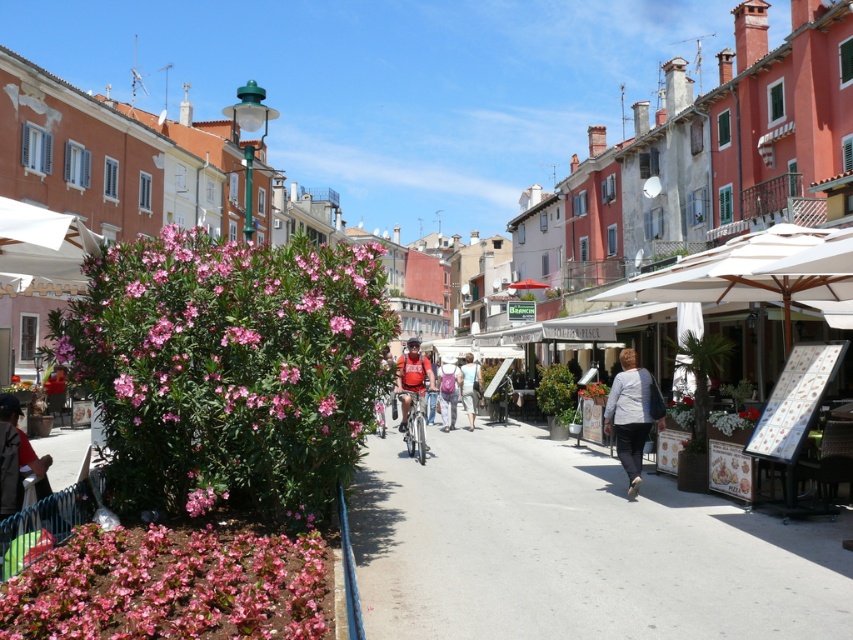
You are a tourist carrying a matte pink backpack at center and want to sit on a bench nearby. There is a narrow space between the pink matte flower at center and the blue railing. Can your backpack fit through that space?

The matte pink backpack at center is thinner than the pink matte flower at center, so the backpack can fit through the narrow space between the flower and the blue railing.

From the picture: You are a tourist in this Mediterranean town and want to take a photo of both the matte pink backpack at center and the pink matte flower at center in the same frame. Which object should you focus on first to ensure both are in the shot?

You should focus on the matte pink backpack at center first because it is positioned under the pink matte flower at center, so by centering the backpack, the flower will naturally be in the frame above it.

You are a tourist in this Mediterranean town and notice two red items at the center of the scene. Which one is closer to you, the matte red shirt at center or the matte red backpack at center?

The matte red shirt at center is positioned over the matte red backpack at center, so the matte red shirt at center is closer to you.